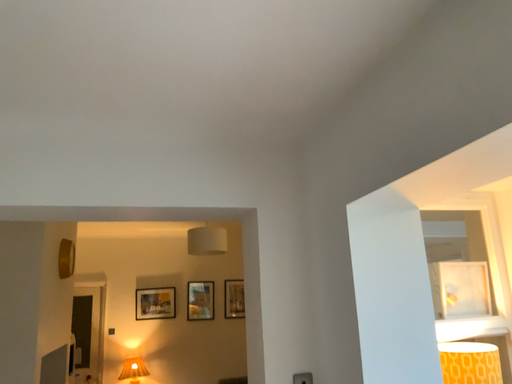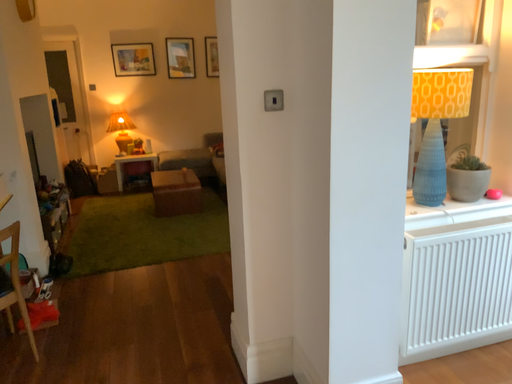
Question: Which way did the camera rotate in the video?

Choices:
 (A) rotated upward
 (B) rotated downward

Answer: (B)